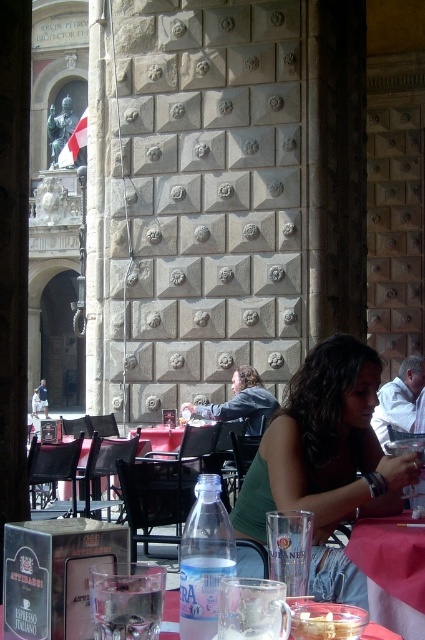
Who is positioned more to the left, transparent plastic bottle at center or clear glass at lower center?

clear glass at lower center is more to the left.

Is point (209, 568) closer to camera compared to point (115, 572)?

That is False.

Does point (226, 561) come in front of point (146, 637)?

No, (226, 561) is further to viewer.

I want to click on transparent plastic bottle at center, so click(204, 560).

Who is more forward, (285, 625) or (300, 618)?

Point (285, 625) is in front.

Where is `clear glass wine glass at lower center`? clear glass wine glass at lower center is located at coordinates (252, 609).

I want to click on transparent plastic bottle at center, so click(x=204, y=560).

Is transparent plastic bottle at center above translucent glass mug at lower center?

Indeed, transparent plastic bottle at center is positioned over translucent glass mug at lower center.

Find the location of `transparent plastic bottle at center`. transparent plastic bottle at center is located at coordinates (204, 560).